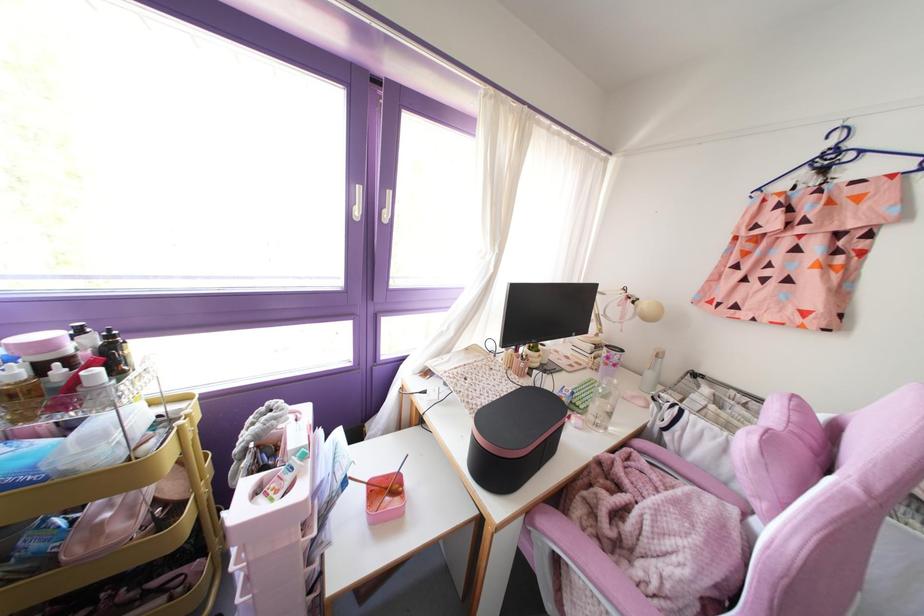
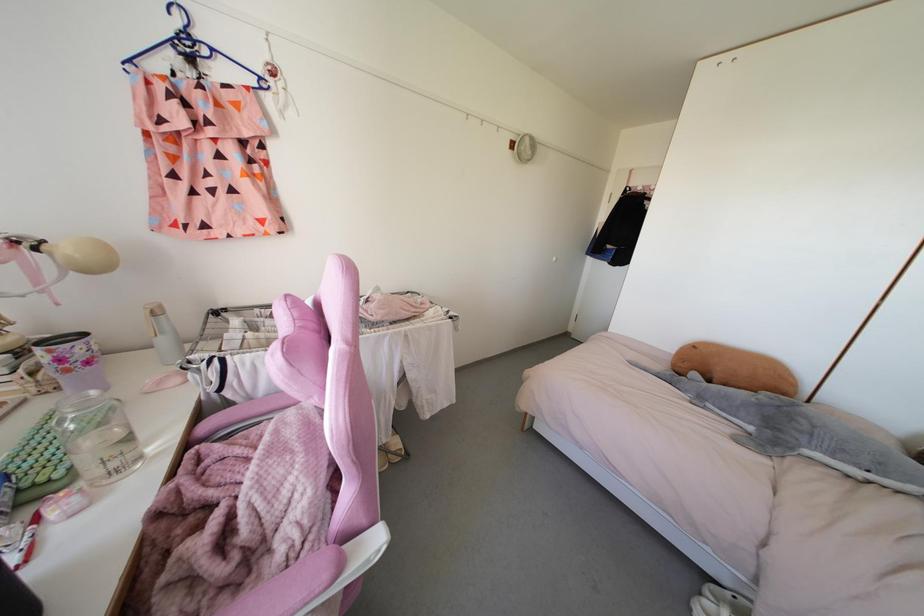
Locate, in the second image, the point that corresponds to (614,381) in the first image.

(92, 392)